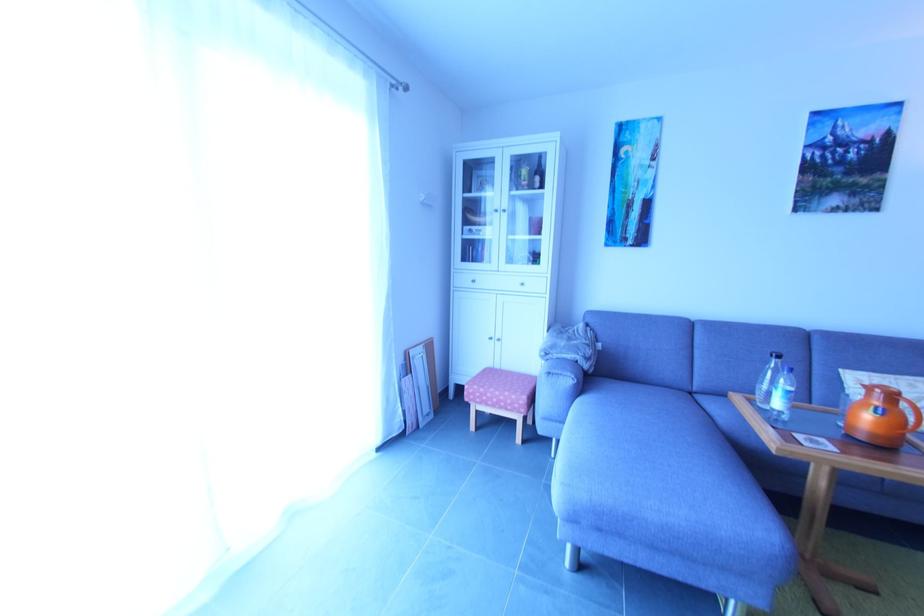
The image size is (924, 616). Describe the element at coordinates (496, 208) in the screenshot. I see `the cabinet knob` at that location.